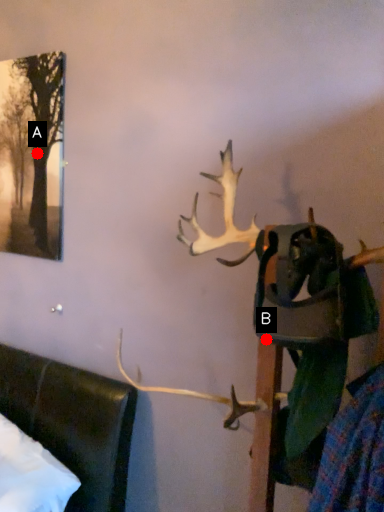
Question: Two points are circled on the image, labeled by A and B beside each circle. Which point appears farthest from the camera in this image?

Choices:
 (A) A is further
 (B) B is further

Answer: (A)